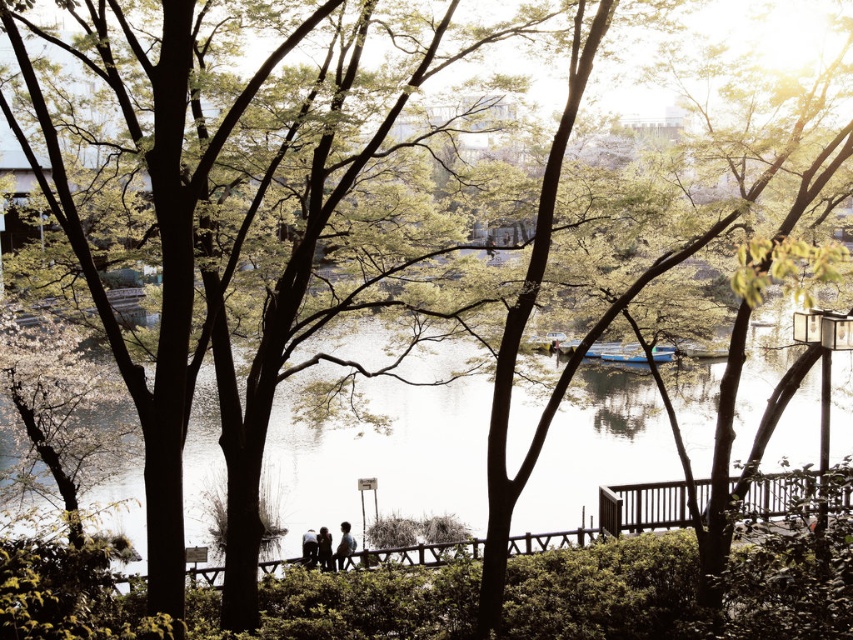
You are standing in the park and see the silhouette wooden couple at center and the blue glossy boat at center. Which object is closer to you?

The silhouette wooden couple at center is closer to you because it is positioned further to the viewer than the blue glossy boat at center.

You are a photographer wanting to capture both the silhouette wooden couple at center and the blue glossy boat at center in the same frame. Based on their positions, which object should you adjust your camera to focus on first to ensure both are in the shot?

The silhouette wooden couple at center is to the left of the blue glossy boat at center. To capture both in the same frame, focus on the silhouette wooden couple at center first as it is positioned further left, then adjust the camera to include the blue glossy boat at center on the right side of the frame.

You are standing in the park and see the clear water at center and the dark blue jeans at center. Which object is higher in position?

The clear water at center is taller than the dark blue jeans at center.